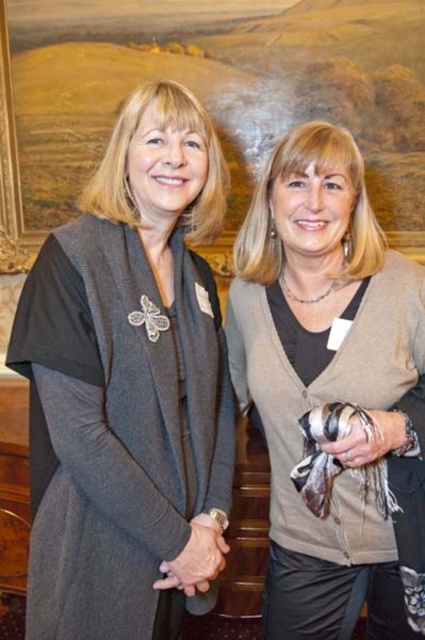
Between matte gray cardigan at center and matte gray scarf at center, which one is positioned higher?

matte gray cardigan at center is higher up.

Who is lower down, matte gray cardigan at center or matte gray scarf at center?

Positioned lower is matte gray scarf at center.

Between point (141, 556) and point (283, 401), which one is positioned in front?

Point (141, 556) is in front.

Locate an element on the screen. The height and width of the screenshot is (640, 425). matte gray cardigan at center is located at coordinates (129, 385).

Which is below, matte gray cardigan at center or wooden frame at upper center?

matte gray cardigan at center

Which is in front, point (176, 384) or point (421, 118)?

Point (176, 384)

Between point (74, 336) and point (23, 236), which one is positioned in front?

Point (74, 336)

Where is `matte gray cardigan at center`? The width and height of the screenshot is (425, 640). matte gray cardigan at center is located at coordinates (129, 385).

Between matte gray scarf at center and wooden frame at upper center, which one is positioned lower?

Positioned lower is matte gray scarf at center.

Which of these two, matte gray scarf at center or wooden frame at upper center, stands taller?

With more height is matte gray scarf at center.

Is point (261, 208) positioned after point (251, 104)?

No, it is not.

Image resolution: width=425 pixels, height=640 pixels. Find the location of `matte gray scarf at center`. matte gray scarf at center is located at coordinates (331, 394).